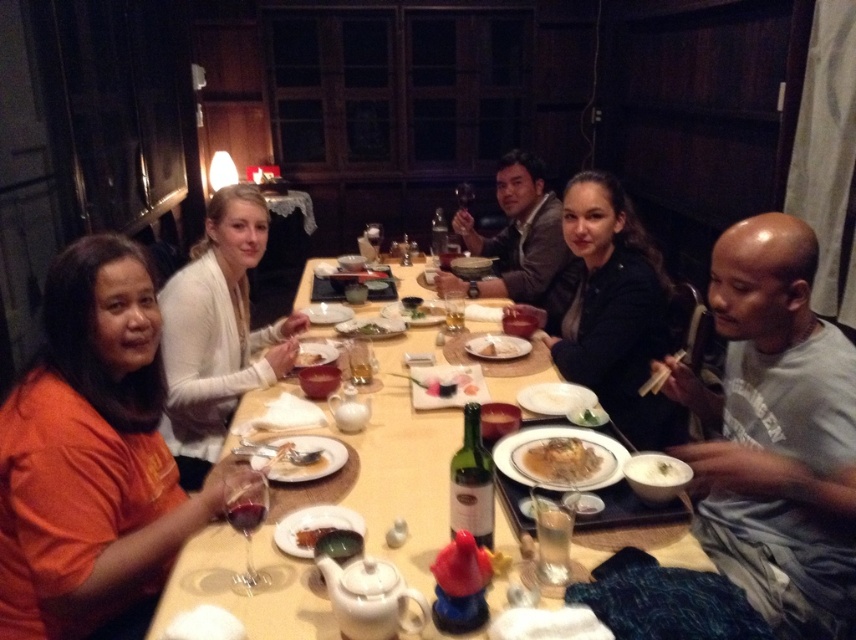
Can you confirm if orange cotton shirt at lower left is positioned to the right of matte ceramic bowl at center?

Incorrect, orange cotton shirt at lower left is not on the right side of matte ceramic bowl at center.

Describe the element at coordinates (93, 458) in the screenshot. The height and width of the screenshot is (640, 856). I see `orange cotton shirt at lower left` at that location.

Which is behind, point (116, 596) or point (307, 360)?

The point (307, 360) is more distant.

At what (x,y) coordinates should I click in order to perform the action: click on orange cotton shirt at lower left. Please return your answer as a coordinate pair (x, y). The image size is (856, 640). Looking at the image, I should click on (93, 458).

Between gray cotton shirt at lower right and golden crispy chicken at center, which one appears on the right side from the viewer's perspective?

From the viewer's perspective, gray cotton shirt at lower right appears more on the right side.

Identify the location of gray cotton shirt at lower right. (776, 433).

Locate an element on the screen. This screenshot has width=856, height=640. gray cotton shirt at lower right is located at coordinates (776, 433).

Does dark brown leather jacket at center lie behind smooth brown jacket at center?

No, it is in front of smooth brown jacket at center.

Can you confirm if dark brown leather jacket at center is wider than smooth brown jacket at center?

Incorrect, dark brown leather jacket at center's width does not surpass smooth brown jacket at center's.

Image resolution: width=856 pixels, height=640 pixels. Describe the element at coordinates (614, 308) in the screenshot. I see `dark brown leather jacket at center` at that location.

Find the location of a particular element. dark brown leather jacket at center is located at coordinates (614, 308).